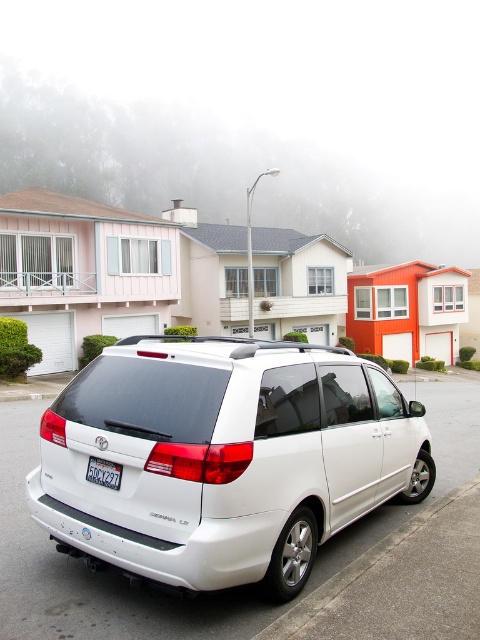
Question: Is white glossy minivan at center behind gray asphalt curb at lower right?

Choices:
 (A) no
 (B) yes

Answer: (B)

Question: Is white glossy minivan at center smaller than gray asphalt curb at lower right?

Choices:
 (A) no
 (B) yes

Answer: (A)

Question: Among these objects, which one is farthest from the camera?

Choices:
 (A) white glossy minivan at center
 (B) gray asphalt curb at lower right

Answer: (A)

Question: Which object appears closest to the camera in this image?

Choices:
 (A) gray asphalt curb at lower right
 (B) black plastic license plate at rear

Answer: (A)

Question: Is white glossy minivan at center closer to camera compared to black plastic license plate at rear?

Choices:
 (A) no
 (B) yes

Answer: (B)

Question: Which object is positioned closest to the white glossy minivan at center?

Choices:
 (A) black plastic license plate at rear
 (B) gray asphalt curb at lower right

Answer: (A)